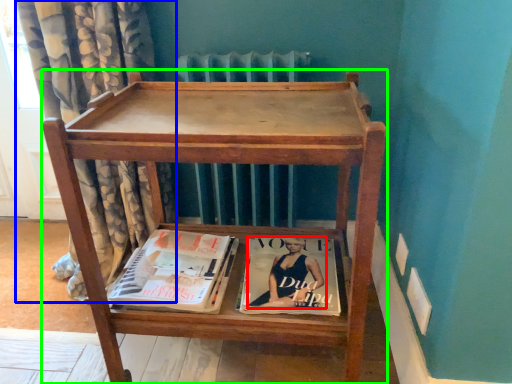
Question: Considering the real-world distances, which object is farthest from person (highlighted by a red box)? curtain (highlighted by a blue box) or furniture (highlighted by a green box)?

Choices:
 (A) curtain
 (B) furniture

Answer: (A)